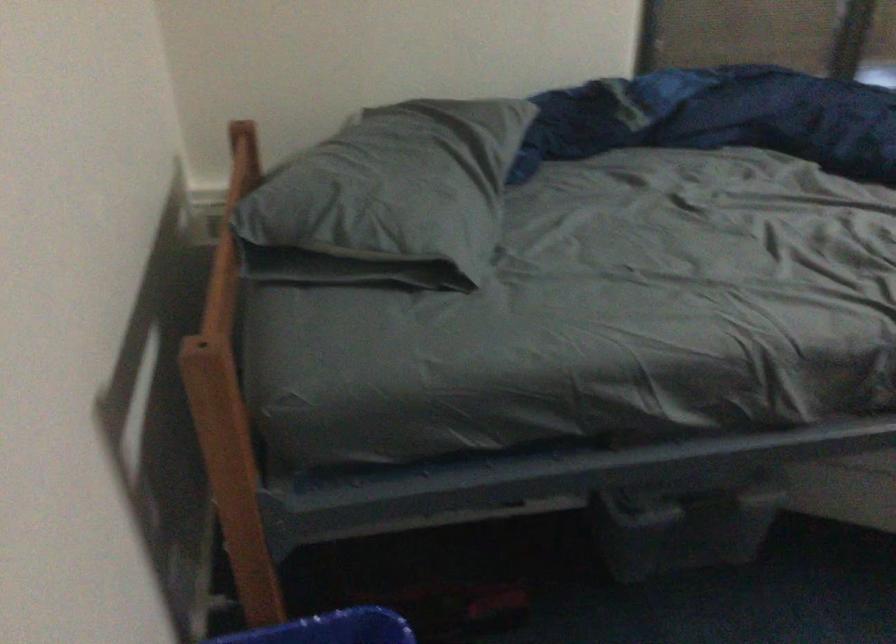
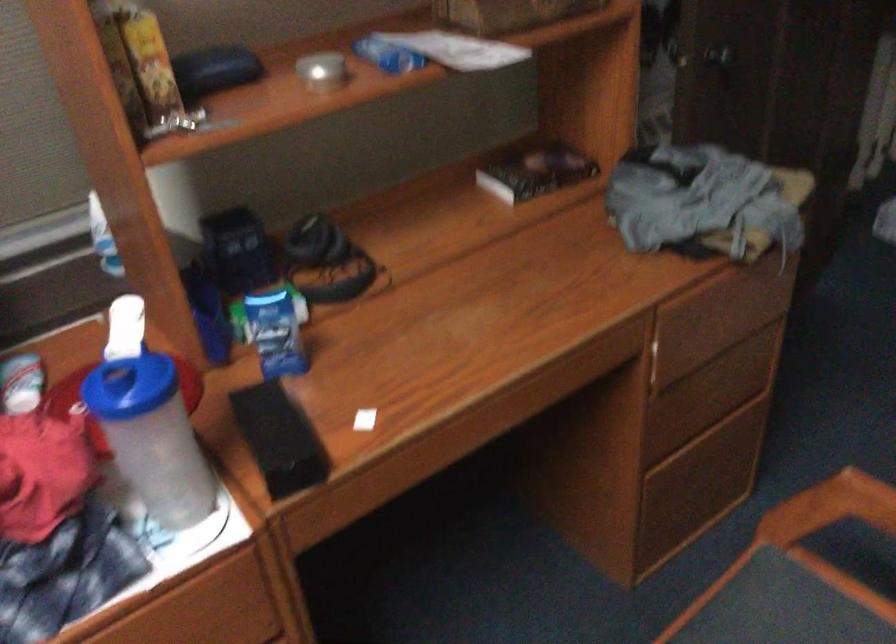
Question: In a continuous first-person perspective shot, in which direction is the camera moving?

Choices:
 (A) Left
 (B) Right
 (C) Forward
 (D) Backward

Answer: (B)